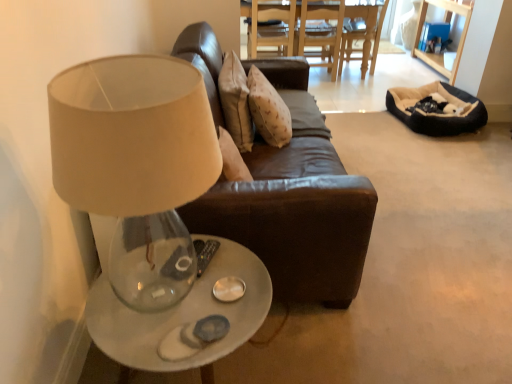
Question: Looking at their shapes, would you say translucent glass table at lower left, which is counted as the second table, starting from the right, is wider or thinner than wooden dining table at center, the 1th table from the right?

Choices:
 (A) wide
 (B) thin

Answer: (B)

Question: Would you say translucent glass table at lower left, which is counted as the second table, starting from the right, is inside or outside wooden dining table at center, placed as the second table when sorted from left to right?

Choices:
 (A) outside
 (B) inside

Answer: (A)

Question: Estimate the real-world distances between objects in this image. Which object is closer to the wooden dining table at center, which is the 2th table in front-to-back order?

Choices:
 (A) beige plush bean bag at right
 (B) beige fabric lampshade at upper left
 (C) brown leather chair at upper center
 (D) beige fabric pillow at center
 (E) translucent glass table at lower left, the 1th table from the bottom

Answer: (C)

Question: Estimate the real-world distances between objects in this image. Which object is farther from the beige fabric lampshade at upper left?

Choices:
 (A) beige plush bean bag at right
 (B) brown leather chair at upper center
 (C) wooden dining table at center, the first table from the top
 (D) beige fabric pillow at center
 (E) translucent glass table at lower left, which ranks as the 1th table in left-to-right order

Answer: (C)